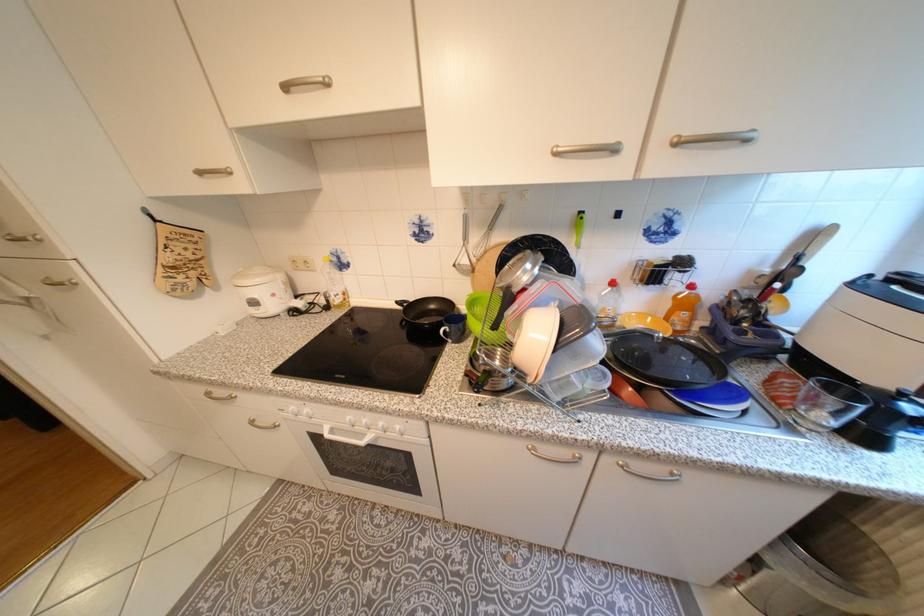
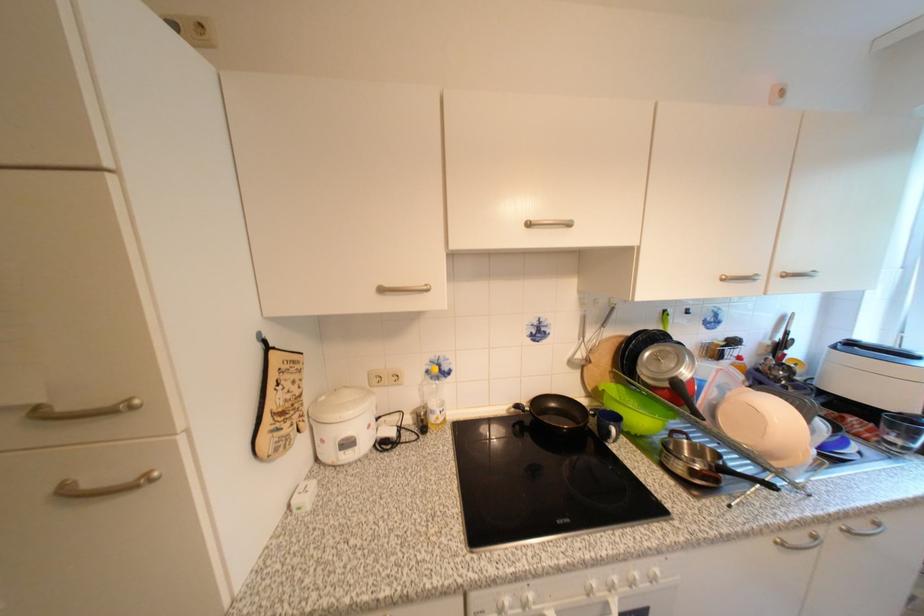
The first image is from the beginning of the video and the second image is from the end. How did the camera likely rotate when shooting the video?

The camera's rotation is toward right-up.